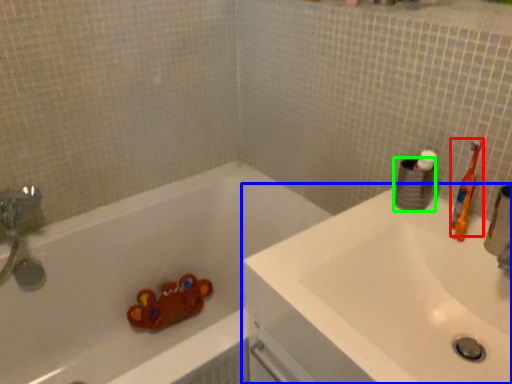
Question: Which object is positioned farthest from toothbrush (highlighted by a red box)? Select from sink (highlighted by a blue box) and toilet paper (highlighted by a green box).

Choices:
 (A) sink
 (B) toilet paper

Answer: (A)